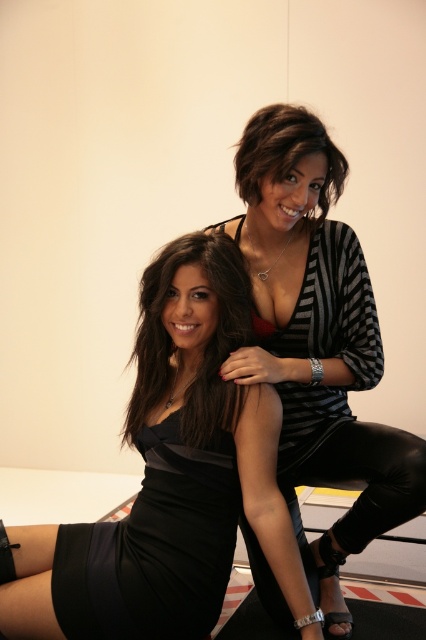
Question: Which object appears closest to the camera in this image?

Choices:
 (A) satin black dress at center
 (B) striped knit cardigan at center
 (C) shiny black hair at upper center

Answer: (C)

Question: Is satin black dress at center further to the viewer compared to shiny black hair at upper center?

Choices:
 (A) yes
 (B) no

Answer: (A)

Question: Is black satin dress at center thinner than shiny black hair at upper center?

Choices:
 (A) no
 (B) yes

Answer: (A)

Question: Which point is farther from the camera taking this photo?

Choices:
 (A) (328, 579)
 (B) (207, 512)

Answer: (A)

Question: Which point is closer to the camera taking this photo?

Choices:
 (A) (296, 200)
 (B) (147, 492)
 (C) (140, 400)

Answer: (A)

Question: Is the position of striped knit cardigan at center less distant than that of satin black dress at center?

Choices:
 (A) no
 (B) yes

Answer: (B)